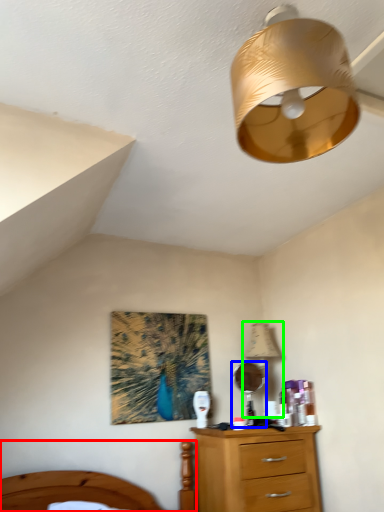
Question: Which object is positioned closest to bed (highlighted by a red box)? Select from mirror (highlighted by a blue box) and table lamp (highlighted by a green box).

Choices:
 (A) mirror
 (B) table lamp

Answer: (A)